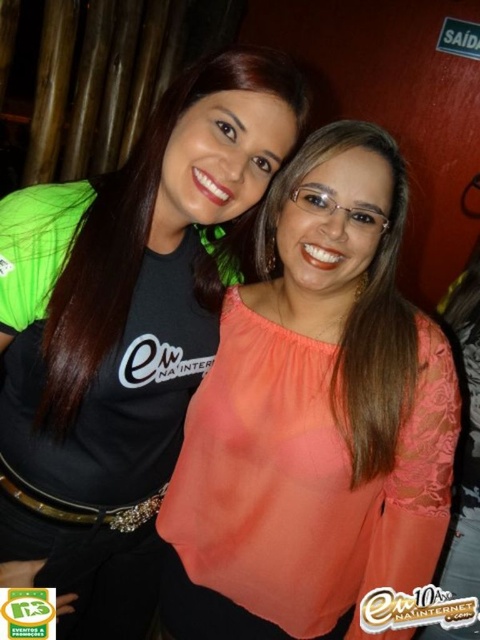
Question: Does coral lace blouse at center have a smaller size compared to matte black shirt at left?

Choices:
 (A) no
 (B) yes

Answer: (B)

Question: Based on their relative distances, which object is nearer to the matte coral blouse at center?

Choices:
 (A) coral lace blouse at center
 (B) matte black shirt at left

Answer: (A)

Question: Is matte black shirt at left thinner than matte coral blouse at center?

Choices:
 (A) no
 (B) yes

Answer: (A)

Question: Which point is farther from the camera taking this photo?

Choices:
 (A) (381, 266)
 (B) (399, 420)

Answer: (A)

Question: Is coral lace blouse at center wider than matte black shirt at left?

Choices:
 (A) yes
 (B) no

Answer: (B)

Question: Which of the following is the farthest from the observer?

Choices:
 (A) (118, 262)
 (B) (377, 243)

Answer: (B)